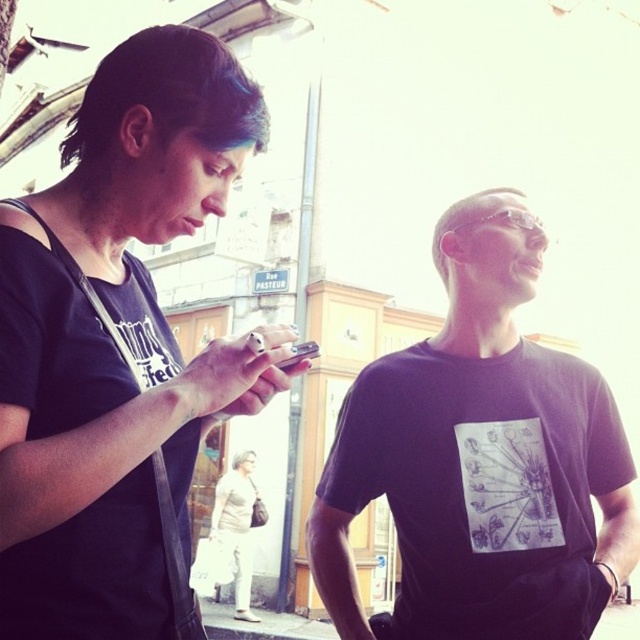
Question: Can you confirm if white cotton pants at lower center is positioned above silver metallic smartphone at center?

Choices:
 (A) no
 (B) yes

Answer: (A)

Question: Is matte black t-shirt at center above black matte t-shirt at center?

Choices:
 (A) yes
 (B) no

Answer: (A)

Question: Is black matte t-shirt at center further to camera compared to silver metallic smartphone at center?

Choices:
 (A) no
 (B) yes

Answer: (A)

Question: Which object appears closest to the camera in this image?

Choices:
 (A) matte black t-shirt at center
 (B) black matte t-shirt at center
 (C) white cotton pants at lower center

Answer: (A)

Question: Which object is the closest to the white cotton pants at lower center?

Choices:
 (A) silver metallic smartphone at center
 (B) matte black t-shirt at center
 (C) black matte t-shirt at center

Answer: (A)

Question: Based on their relative distances, which object is nearer to the matte black t-shirt at center?

Choices:
 (A) black matte t-shirt at center
 (B) silver metallic smartphone at center
 (C) white cotton pants at lower center

Answer: (B)